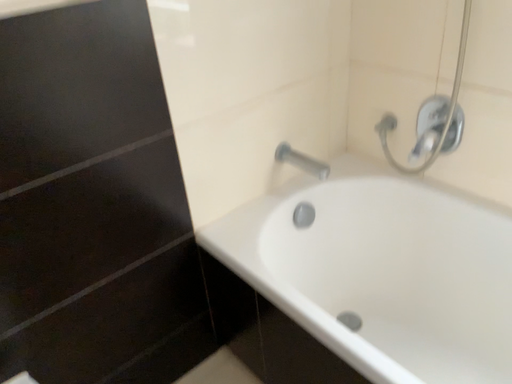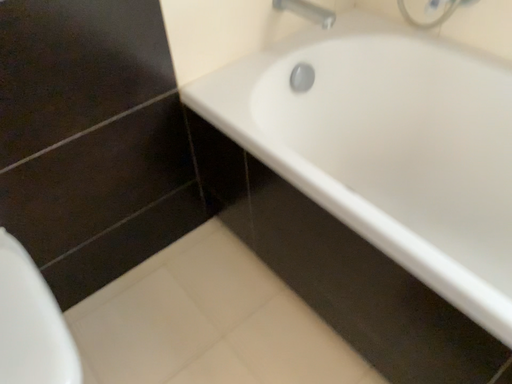
Question: Which way did the camera rotate in the video?

Choices:
 (A) rotated downward
 (B) rotated upward

Answer: (A)